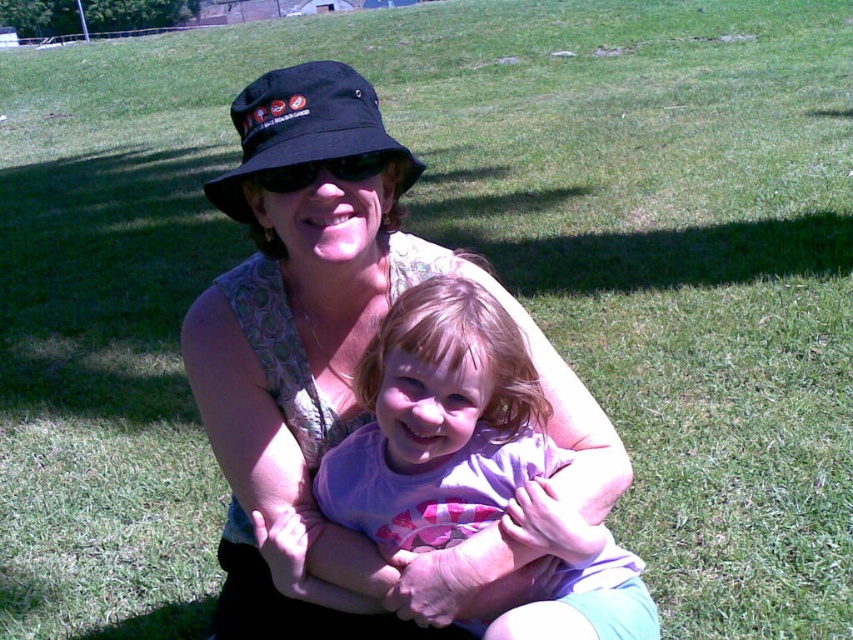
You are a photographer trying to capture a photo of the purple cotton shirt at center and the black fabric hat at upper center. Since you want to ensure both are visible, which object should you focus on first to account for their sizes?

The purple cotton shirt at center is larger in size than the black fabric hat at upper center, so you should focus on the purple cotton shirt at center first as it occupies more space in the frame.

You are standing in the park and want to walk from the point at coordinates (x=515, y=467) to the point at coordinates (x=271, y=156). Which direction should you move in relation to the scene?

You should move towards the background of the scene because point (x=271, y=156) is closer to the viewer than point (x=515, y=467).

You are a photographer trying to capture a candid shot of the purple cotton shirt at center and the black fabric hat at upper center. Since you want both subjects to be in focus, which one should you focus on first to ensure the other is also sharp?

The purple cotton shirt at center is closer to the viewer than the black fabric hat at upper center, so you should focus on the purple cotton shirt at center first. This ensures that the black fabric hat at upper center will also be in focus because it is farther away.